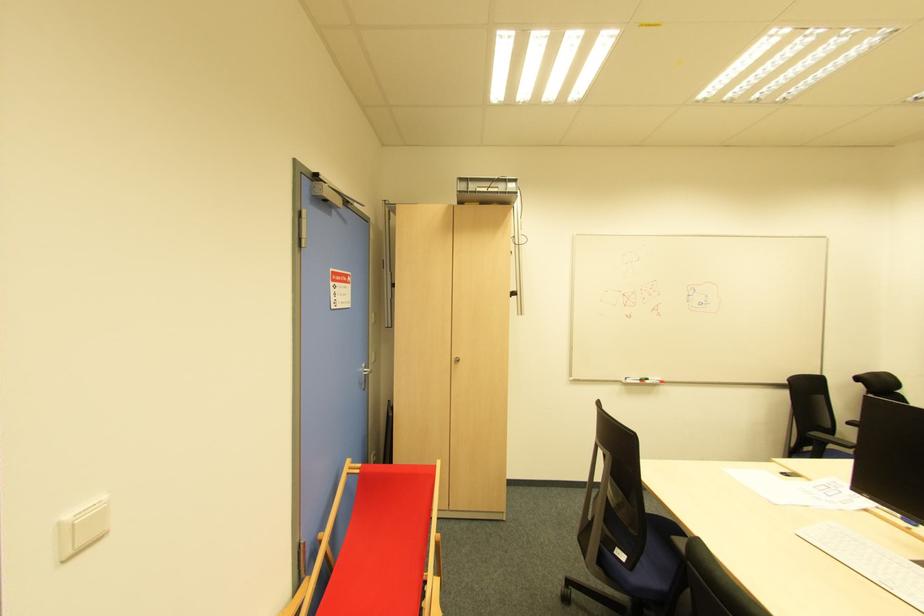
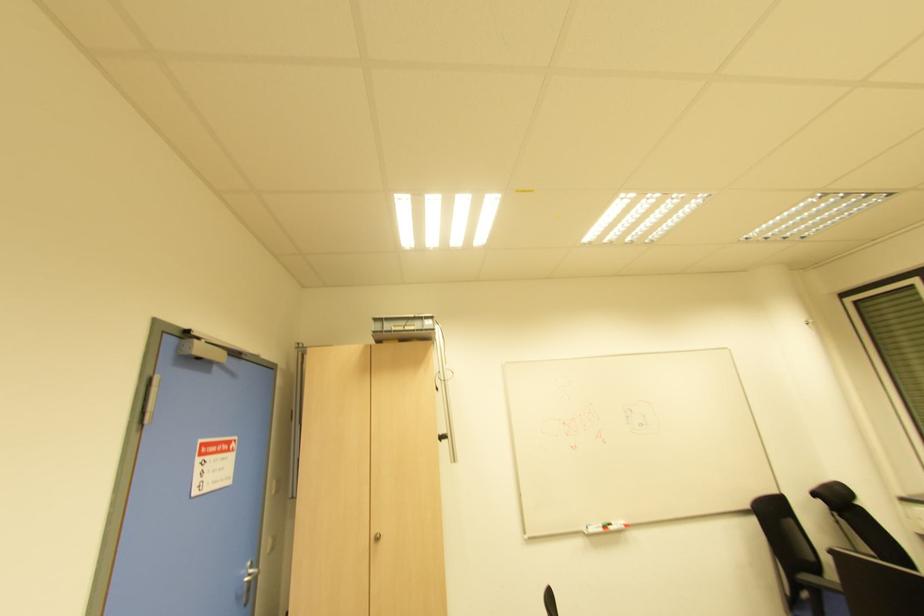
Question: How did the camera likely rotate?

Choices:
 (A) Left
 (B) Right
 (C) Up
 (D) Down

Answer: (C)